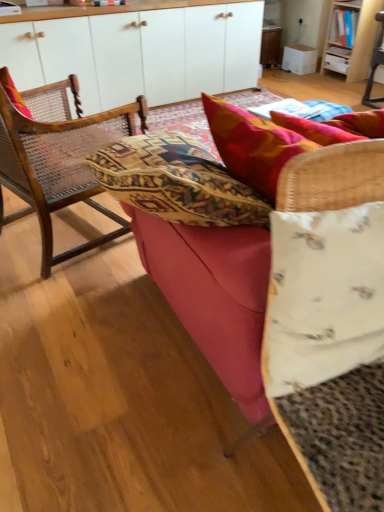
Question: In which direction should I rotate to look at white fabric pillow at center, acting as the 1th pillow starting from the bottom?

Choices:
 (A) left
 (B) right

Answer: (B)

Question: Is wooden bookshelf at upper right beside woven wood chair at left?

Choices:
 (A) yes
 (B) no

Answer: (B)

Question: Is wooden bookshelf at upper right located outside woven wood chair at left?

Choices:
 (A) no
 (B) yes

Answer: (B)

Question: Is wooden bookshelf at upper right facing towards woven wood chair at left?

Choices:
 (A) no
 (B) yes

Answer: (A)

Question: Considering the relative sizes of wooden bookshelf at upper right and woven wood chair at left in the image provided, is wooden bookshelf at upper right thinner than woven wood chair at left?

Choices:
 (A) no
 (B) yes

Answer: (B)

Question: Can you confirm if wooden bookshelf at upper right is shorter than woven wood chair at left?

Choices:
 (A) no
 (B) yes

Answer: (B)

Question: Is wooden bookshelf at upper right wider than woven wood chair at left?

Choices:
 (A) yes
 (B) no

Answer: (B)

Question: Can you confirm if wooden bookshelf at upper right is taller than white fabric pillow at center, acting as the 1th pillow starting from the bottom?

Choices:
 (A) no
 (B) yes

Answer: (B)

Question: Considering the relative sizes of wooden bookshelf at upper right and white fabric pillow at center, the first pillow when ordered from front to back, in the image provided, is wooden bookshelf at upper right shorter than white fabric pillow at center, the first pillow when ordered from front to back,?

Choices:
 (A) yes
 (B) no

Answer: (B)

Question: From a real-world perspective, is wooden bookshelf at upper right over white fabric pillow at center, which is the 2th pillow from top to bottom?

Choices:
 (A) no
 (B) yes

Answer: (A)

Question: Is white fabric pillow at center, acting as the 1th pillow starting from the bottom, surrounded by wooden bookshelf at upper right?

Choices:
 (A) no
 (B) yes

Answer: (A)

Question: Is wooden bookshelf at upper right beside white fabric pillow at center, which is the second pillow in back-to-front order?

Choices:
 (A) no
 (B) yes

Answer: (A)

Question: Is wooden bookshelf at upper right positioned behind white fabric pillow at center, acting as the 1th pillow starting from the bottom?

Choices:
 (A) no
 (B) yes

Answer: (B)

Question: Is woven wood chair at left at the right side of velvet red couch at center?

Choices:
 (A) no
 (B) yes

Answer: (A)